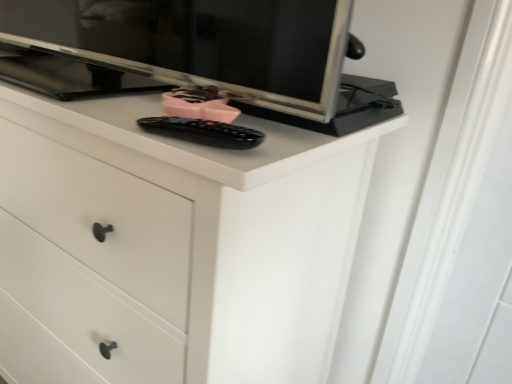
Question: From the image's perspective, would you say black plastic remote at center is shown under white matte chest of drawers at center?

Choices:
 (A) yes
 (B) no

Answer: (B)

Question: Could you tell me if black plastic remote at center is facing white matte chest of drawers at center?

Choices:
 (A) no
 (B) yes

Answer: (A)

Question: From a real-world perspective, is black plastic remote at center positioned over white matte chest of drawers at center based on gravity?

Choices:
 (A) yes
 (B) no

Answer: (A)

Question: From a real-world perspective, is black plastic remote at center located beneath white matte chest of drawers at center?

Choices:
 (A) yes
 (B) no

Answer: (B)

Question: Considering the relative positions of black plastic remote at center and white matte chest of drawers at center in the image provided, is black plastic remote at center to the right of white matte chest of drawers at center from the viewer's perspective?

Choices:
 (A) yes
 (B) no

Answer: (A)

Question: Does black plastic remote at center have a lesser height compared to white matte chest of drawers at center?

Choices:
 (A) yes
 (B) no

Answer: (A)

Question: Does white matte chest of drawers at center contain black plastic remote at center?

Choices:
 (A) no
 (B) yes

Answer: (B)

Question: Is white matte chest of drawers at center oriented away from black plastic remote at center?

Choices:
 (A) no
 (B) yes

Answer: (A)

Question: Is white matte chest of drawers at center thinner than black plastic remote at center?

Choices:
 (A) yes
 (B) no

Answer: (B)

Question: Is white matte chest of drawers at center oriented towards black plastic remote at center?

Choices:
 (A) no
 (B) yes

Answer: (A)

Question: Does white matte chest of drawers at center appear on the left side of black plastic remote at center?

Choices:
 (A) no
 (B) yes

Answer: (B)

Question: From the image's perspective, would you say white matte chest of drawers at center is positioned over black plastic remote at center?

Choices:
 (A) yes
 (B) no

Answer: (B)

Question: From the image's perspective, relative to black plastic remote at center, is white matte chest of drawers at center above or below?

Choices:
 (A) below
 (B) above

Answer: (A)